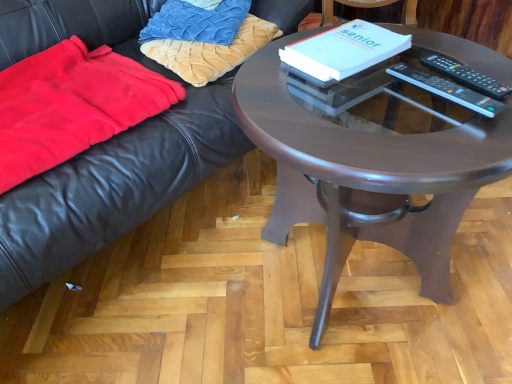
At what (x,y) coordinates should I click in order to perform the action: click on velvet gold pillow at upper left, positioned as the first pillow in bottom-to-top order. Please return your answer as a coordinate pair (x, y). The height and width of the screenshot is (384, 512). Looking at the image, I should click on (211, 52).

What are the coordinates of `red fleece blanket at left` in the screenshot? It's located at (72, 105).

The width and height of the screenshot is (512, 384). Describe the element at coordinates (342, 51) in the screenshot. I see `white paper at center` at that location.

What are the coordinates of `matte brown table at center` in the screenshot? It's located at (367, 173).

Is black plastic remote control at right, positioned as the 2th remote control in right-to-left order, in front of velvet gold pillow at upper left, positioned as the first pillow in bottom-to-top order?

Yes, it is in front of velvet gold pillow at upper left, positioned as the first pillow in bottom-to-top order.

From a real-world perspective, is black plastic remote control at right, positioned as the 2th remote control in right-to-left order, under velvet gold pillow at upper left, which is the 2th pillow in top-to-bottom order?

No.

From the picture: Can velvet gold pillow at upper left, which is the 2th pillow in top-to-bottom order, be found inside black plastic remote control at right, which is counted as the first remote control, starting from the left?

Definitely not — velvet gold pillow at upper left, which is the 2th pillow in top-to-bottom order, is not inside black plastic remote control at right, which is counted as the first remote control, starting from the left.

From the image's perspective, is black plastic remote control at right, which is counted as the first remote control, starting from the left, on velvet gold pillow at upper left, positioned as the first pillow in bottom-to-top order?

Actually, black plastic remote control at right, which is counted as the first remote control, starting from the left, appears below velvet gold pillow at upper left, positioned as the first pillow in bottom-to-top order, in the image.

Are white paper at center and black plastic remote control at right, which is counted as the first remote control, starting from the left, making contact?

No.

How distant is white paper at center from black plastic remote control at right, which is counted as the first remote control, starting from the left?

white paper at center is 4.72 inches from black plastic remote control at right, which is counted as the first remote control, starting from the left.

Does point (294, 61) come behind point (481, 105)?

Yes, point (294, 61) is farther from viewer.

Considering the sizes of white paper at center and black plastic remote control at right, which is counted as the first remote control, starting from the left, in the image, is white paper at center bigger or smaller than black plastic remote control at right, which is counted as the first remote control, starting from the left,?

Considering their sizes, white paper at center takes up more space than black plastic remote control at right, which is counted as the first remote control, starting from the left.

From the image's perspective, does red fleece blanket at left appear higher than velvet blue pillow at upper left, the second pillow from the bottom?

No, from the image's perspective, red fleece blanket at left is not on top of velvet blue pillow at upper left, the second pillow from the bottom.

Considering the relative sizes of red fleece blanket at left and velvet blue pillow at upper left, which is the 1th pillow in top-to-bottom order, in the image provided, is red fleece blanket at left shorter than velvet blue pillow at upper left, which is the 1th pillow in top-to-bottom order,?

Yes, red fleece blanket at left is shorter than velvet blue pillow at upper left, which is the 1th pillow in top-to-bottom order.

From a real-world perspective, is red fleece blanket at left located higher than velvet blue pillow at upper left, which is the 1th pillow in top-to-bottom order?

No, from a real-world perspective, red fleece blanket at left is not over velvet blue pillow at upper left, which is the 1th pillow in top-to-bottom order

Find the location of a particular element. This screenshot has width=512, height=384. blanket on the left side of velvet blue pillow at upper left, which is the 1th pillow in top-to-bottom order is located at coordinates pos(72,105).

Considering the positions of points (218, 15) and (494, 85), is point (218, 15) farther from camera compared to point (494, 85)?

That is True.

Is velvet blue pillow at upper left, the second pillow from the bottom, turned away from black plastic remote control at upper right, which is the 2th remote control in left-to-right order?

No, velvet blue pillow at upper left, the second pillow from the bottom, is not facing away from black plastic remote control at upper right, which is the 2th remote control in left-to-right order.

Is velvet blue pillow at upper left, which is the 1th pillow in top-to-bottom order, far from black plastic remote control at upper right, placed as the 1th remote control when sorted from right to left?

They are positioned close to each other.

Based on the photo, can you confirm if white paper at center is positioned to the left of black leather couch at upper left?

Incorrect, white paper at center is not on the left side of black leather couch at upper left.

From their relative heights in the image, would you say white paper at center is taller or shorter than black leather couch at upper left?

In the image, white paper at center appears to be shorter than black leather couch at upper left.

What's the angular difference between white paper at center and black leather couch at upper left's facing directions?

The facing directions of white paper at center and black leather couch at upper left are 5.78 degrees apart.

Measure the distance from white paper at center to black leather couch at upper left.

A distance of 20.84 inches exists between white paper at center and black leather couch at upper left.

From a real-world perspective, is velvet gold pillow at upper left, which is the 2th pillow in top-to-bottom order, over matte brown table at center?

Correct, in the physical world, velvet gold pillow at upper left, which is the 2th pillow in top-to-bottom order, is higher than matte brown table at center.

Does velvet gold pillow at upper left, which is the 2th pillow in top-to-bottom order, have a larger size compared to matte brown table at center?

No, velvet gold pillow at upper left, which is the 2th pillow in top-to-bottom order, is not bigger than matte brown table at center.

Is velvet gold pillow at upper left, which is the 2th pillow in top-to-bottom order, far from matte brown table at center?

That's not correct — velvet gold pillow at upper left, which is the 2th pillow in top-to-bottom order, is a little close to matte brown table at center.

Relative to matte brown table at center, is velvet gold pillow at upper left, positioned as the first pillow in bottom-to-top order, in front or behind?

In the image, velvet gold pillow at upper left, positioned as the first pillow in bottom-to-top order, appears behind matte brown table at center.

Is black plastic remote control at right, which is counted as the first remote control, starting from the left, facing towards black plastic remote control at upper right, which is the 2th remote control in left-to-right order?

No, black plastic remote control at right, which is counted as the first remote control, starting from the left, is not turned towards black plastic remote control at upper right, which is the 2th remote control in left-to-right order.

From a real-world perspective, relative to black plastic remote control at upper right, which is the 2th remote control in left-to-right order, is black plastic remote control at right, positioned as the 2th remote control in right-to-left order, vertically above or below?

black plastic remote control at right, positioned as the 2th remote control in right-to-left order, is below black plastic remote control at upper right, which is the 2th remote control in left-to-right order.

From the image's perspective, is black plastic remote control at right, positioned as the 2th remote control in right-to-left order, located beneath black plastic remote control at upper right, placed as the 1th remote control when sorted from right to left?

Yes, from the image's perspective, black plastic remote control at right, positioned as the 2th remote control in right-to-left order, is beneath black plastic remote control at upper right, placed as the 1th remote control when sorted from right to left.

Does black plastic remote control at right, positioned as the 2th remote control in right-to-left order, have a lesser width compared to black plastic remote control at upper right, placed as the 1th remote control when sorted from right to left?

No.

I want to click on the 1st pillow behind the black plastic remote control at right, which is counted as the first remote control, starting from the left, so click(x=211, y=52).

Which remote control is the 1st one when counting from the right side of the white paper at center? Please provide its 2D coordinates.

[(448, 90)]

Based on their spatial positions, is matte brown table at center or velvet gold pillow at upper left, which is the 2th pillow in top-to-bottom order, closer to white paper at center?

matte brown table at center.

Based on their spatial positions, is velvet gold pillow at upper left, which is the 2th pillow in top-to-bottom order, or red fleece blanket at left further from velvet blue pillow at upper left, the second pillow from the bottom?

Among the two, red fleece blanket at left is located further to velvet blue pillow at upper left, the second pillow from the bottom.

Looking at the image, which one is located closer to black plastic remote control at right, which is counted as the first remote control, starting from the left, white paper at center or black leather couch at upper left?

Based on the image, white paper at center appears to be nearer to black plastic remote control at right, which is counted as the first remote control, starting from the left.

Considering their positions, is white paper at center positioned closer to velvet blue pillow at upper left, which is the 1th pillow in top-to-bottom order, than black leather couch at upper left?

black leather couch at upper left is closer to velvet blue pillow at upper left, which is the 1th pillow in top-to-bottom order.

Looking at the image, which one is located further to velvet gold pillow at upper left, positioned as the first pillow in bottom-to-top order, black plastic remote control at upper right, which is the 2th remote control in left-to-right order, or white paper at center?

Based on the image, black plastic remote control at upper right, which is the 2th remote control in left-to-right order, appears to be further to velvet gold pillow at upper left, positioned as the first pillow in bottom-to-top order.

Which object lies nearer to the anchor point matte brown table at center, white paper at center or black leather couch at upper left?

white paper at center is closer to matte brown table at center.

When comparing their distances from black plastic remote control at right, which is counted as the first remote control, starting from the left, does velvet blue pillow at upper left, which is the 1th pillow in top-to-bottom order, or black leather couch at upper left seem further?

black leather couch at upper left.

Considering their positions, is red fleece blanket at left positioned further to velvet gold pillow at upper left, which is the 2th pillow in top-to-bottom order, than black plastic remote control at right, positioned as the 2th remote control in right-to-left order?

The object further to velvet gold pillow at upper left, which is the 2th pillow in top-to-bottom order, is black plastic remote control at right, positioned as the 2th remote control in right-to-left order.

Where is `blanket positioned between black leather couch at upper left and velvet blue pillow at upper left, the second pillow from the bottom, from near to far`? The width and height of the screenshot is (512, 384). blanket positioned between black leather couch at upper left and velvet blue pillow at upper left, the second pillow from the bottom, from near to far is located at coordinates (72, 105).

Image resolution: width=512 pixels, height=384 pixels. In order to click on paperback book positioned between matte brown table at center and velvet gold pillow at upper left, positioned as the first pillow in bottom-to-top order, from near to far in this screenshot , I will do `click(342, 51)`.

Locate an element on the screen. coffee table between red fleece blanket at left and black plastic remote control at upper right, which is the 2th remote control in left-to-right order, from left to right is located at coordinates (367, 173).

Locate an element on the screen. paperback book situated between velvet gold pillow at upper left, which is the 2th pillow in top-to-bottom order, and black plastic remote control at right, positioned as the 2th remote control in right-to-left order, from left to right is located at coordinates (342, 51).